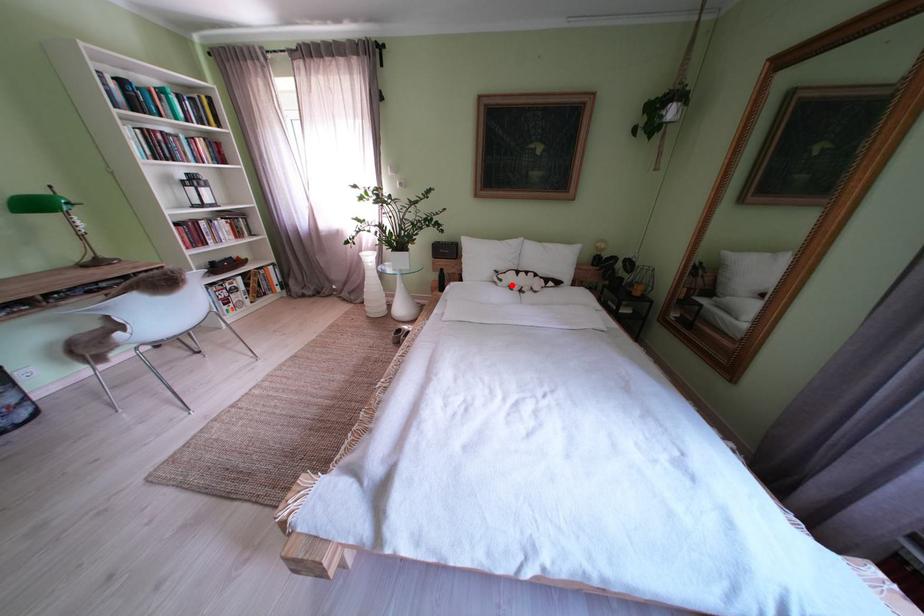
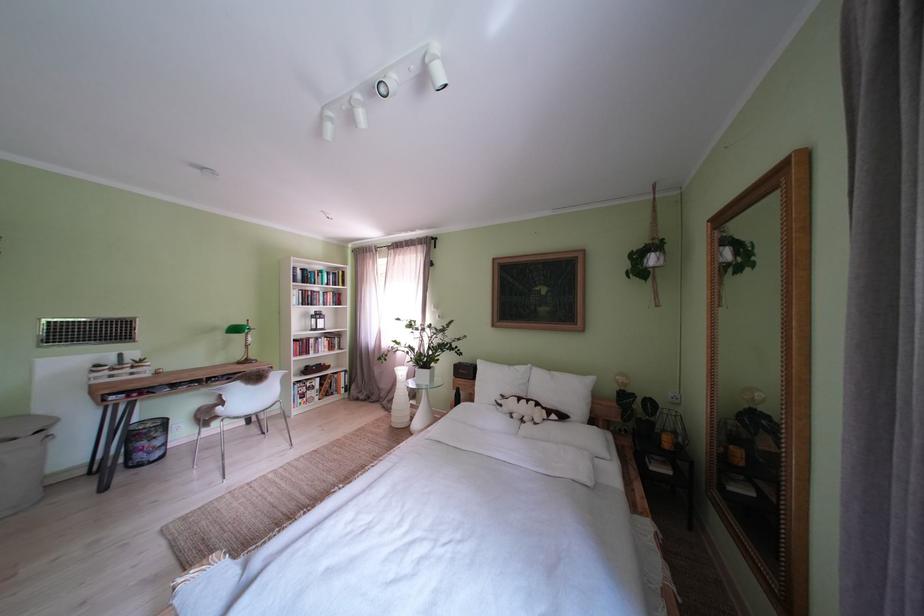
In the second image, find the point that corresponds to the highlighted location in the first image.

(512, 411)